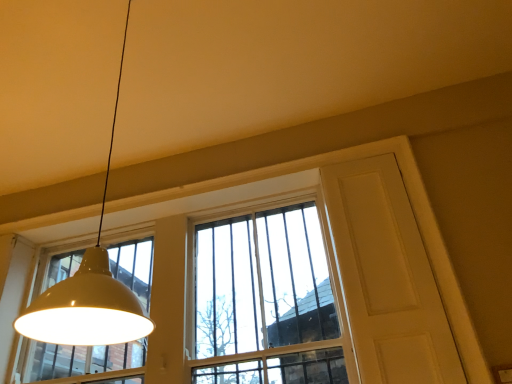
At what (x,y) coordinates should I click in order to perform the action: click on clear glass window at center. Please return your answer as a coordinate pair (x, y). Looking at the image, I should click on (227, 291).

Is white glossy lampshade at upper left oriented away from white matte screen door at upper right?

That's not correct — white glossy lampshade at upper left is not looking away from white matte screen door at upper right.

Can you confirm if white glossy lampshade at upper left is positioned to the right of white matte screen door at upper right?

Incorrect, white glossy lampshade at upper left is not on the right side of white matte screen door at upper right.

Looking at this image, can you confirm if white glossy lampshade at upper left is smaller than white matte screen door at upper right?

Actually, white glossy lampshade at upper left might be larger than white matte screen door at upper right.

Is white glossy lampshade at upper left situated inside white matte screen door at upper right or outside?

white glossy lampshade at upper left is not inside white matte screen door at upper right, it's outside.

Is clear glass window at center inside the boundaries of white matte screen door at upper right, or outside?

clear glass window at center cannot be found inside white matte screen door at upper right.

Which is more to the right, clear glass window at center or white matte screen door at upper right?

Positioned to the right is white matte screen door at upper right.

Which object is thinner, clear glass window at center or white matte screen door at upper right?

white matte screen door at upper right.

Is there a large distance between clear glass window at center and white matte screen door at upper right?

clear glass window at center is actually quite close to white matte screen door at upper right.

Between white matte screen door at upper right and white glossy lampshade at upper left, which one has more height?

Standing taller between the two is white glossy lampshade at upper left.

Where is `screen door located underneath the white glossy lampshade at upper left (from a real-world perspective)`? The width and height of the screenshot is (512, 384). screen door located underneath the white glossy lampshade at upper left (from a real-world perspective) is located at coordinates (387, 277).

Does point (420, 333) lie behind point (79, 329)?

Yes, point (420, 333) is behind point (79, 329).

Consider the image. Is clear glass window at center at the left side of white glossy lampshade at upper left?

Correct, you'll find clear glass window at center to the left of white glossy lampshade at upper left.

Is clear glass window at center positioned with its back to white glossy lampshade at upper left?

No, clear glass window at center is not facing away from white glossy lampshade at upper left.

Is white glossy lampshade at upper left surrounded by clear glass window at center?

No, white glossy lampshade at upper left is located outside of clear glass window at center.

Can you confirm if white glossy lampshade at upper left is smaller than clear glass window at center?

Correct, white glossy lampshade at upper left occupies less space than clear glass window at center.

Is white glossy lampshade at upper left wider or thinner than clear glass window at center?

Considering their sizes, white glossy lampshade at upper left looks broader than clear glass window at center.

In the image, there is a white glossy lampshade at upper left. Where is `window below it (from the image's perspective)`? The image size is (512, 384). window below it (from the image's perspective) is located at coordinates (227, 291).

Considering the relative sizes of white matte screen door at upper right and clear glass window at center in the image provided, is white matte screen door at upper right thinner than clear glass window at center?

Correct, the width of white matte screen door at upper right is less than that of clear glass window at center.

From the picture: Is white matte screen door at upper right taller or shorter than clear glass window at center?

white matte screen door at upper right is taller than clear glass window at center.

Is white matte screen door at upper right positioned beyond the bounds of clear glass window at center?

That's correct, white matte screen door at upper right is outside of clear glass window at center.

Looking at this image, which object is positioned more to the right, white matte screen door at upper right or clear glass window at center?

Positioned to the right is white matte screen door at upper right.

Locate an element on the screen. Image resolution: width=512 pixels, height=384 pixels. lamp in front of the white matte screen door at upper right is located at coordinates (88, 293).

This screenshot has height=384, width=512. I want to click on screen door located on the right of clear glass window at center, so click(x=387, y=277).

Which object lies further to the anchor point white glossy lampshade at upper left, clear glass window at center or white matte screen door at upper right?

clear glass window at center is positioned further to the anchor white glossy lampshade at upper left.

Looking at the image, which one is located closer to white glossy lampshade at upper left, white matte screen door at upper right or clear glass window at center?

white matte screen door at upper right is positioned closer to the anchor white glossy lampshade at upper left.

When comparing their distances from white matte screen door at upper right, does white glossy lampshade at upper left or clear glass window at center seem further?

white glossy lampshade at upper left is further to white matte screen door at upper right.

Considering their positions, is white glossy lampshade at upper left positioned further to clear glass window at center than white matte screen door at upper right?

white glossy lampshade at upper left lies further to clear glass window at center than the other object.

Based on their spatial positions, is white matte screen door at upper right or white glossy lampshade at upper left further from clear glass window at center?

white glossy lampshade at upper left.

Estimate the real-world distances between objects in this image. Which object is closer to white matte screen door at upper right, clear glass window at center or white glossy lampshade at upper left?

clear glass window at center is positioned closer to the anchor white matte screen door at upper right.

Locate an element on the screen. The width and height of the screenshot is (512, 384). lamp between clear glass window at center and white matte screen door at upper right is located at coordinates (88, 293).